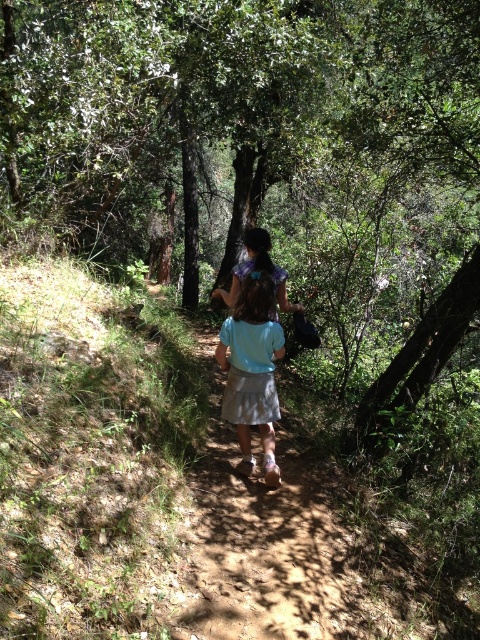
You are standing on the dirt path and want to walk towards the two points marked in the scene. Which point, point (248, 314) or point (256, 248), would you reach first?

You would reach point (248, 314) first because it is closer to you than point (256, 248).

You are observing two light blue fabrics in the scene. One is labeled as the light blue fabric shirt at center, and the other is simply light blue fabric at center. According to the description, which one is positioned lower in the image?

The light blue fabric shirt at center is below the light blue fabric at center, so the light blue fabric shirt at center is positioned lower in the image.